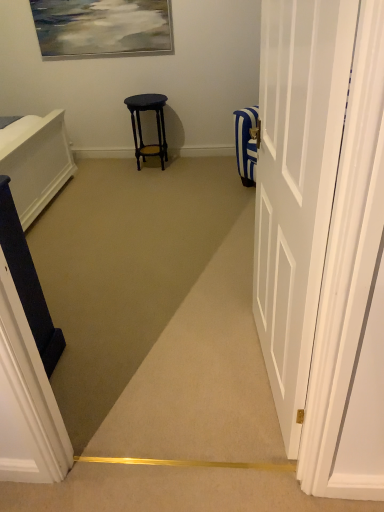
Identify the location of matte black stool at center. This screenshot has height=512, width=384. (141, 129).

Describe the element at coordinates (296, 184) in the screenshot. The width and height of the screenshot is (384, 512). I see `white glossy door at right` at that location.

Find the location of a particular element. matte black stool at center is located at coordinates (141, 129).

There is a dark blue fabric at left. Where is `door above it (from a real-world perspective)`? The height and width of the screenshot is (512, 384). door above it (from a real-world perspective) is located at coordinates (296, 184).

From the picture: Could you tell me if dark blue fabric at left is turned towards white glossy door at right?

No, dark blue fabric at left is not turned towards white glossy door at right.

From the picture: Is white glossy door at right completely or partially inside dark blue fabric at left?

No, white glossy door at right is not a part of dark blue fabric at left.

Can you tell me how much matte black stool at center and white glossy door at right differ in facing direction?

matte black stool at center and white glossy door at right are facing 85.1 degrees away from each other.

At what (x,y) coordinates should I click in order to perform the action: click on stool below the white glossy door at right (from a real-world perspective). Please return your answer as a coordinate pair (x, y). Looking at the image, I should click on (141, 129).

Is matte black stool at center situated inside white glossy door at right or outside?

matte black stool at center cannot be found inside white glossy door at right.

Is point (263, 115) farther from camera compared to point (153, 147)?

No, (263, 115) is closer to viewer.

Locate an element on the screen. The image size is (384, 512). stool that is under the white glossy door at right (from a real-world perspective) is located at coordinates (141, 129).

In the scene shown: In terms of width, does white glossy door at right look wider or thinner when compared to matte black stool at center?

Considering their sizes, white glossy door at right looks slimmer than matte black stool at center.

Is matte black stool at center far away from dark blue fabric at left?

Yes.

Between matte black stool at center and dark blue fabric at left, which one is positioned in front?

dark blue fabric at left.

Is matte black stool at center at the left side of dark blue fabric at left?

No, matte black stool at center is not to the left of dark blue fabric at left.

Is matte black stool at center oriented towards dark blue fabric at left?

Yes, matte black stool at center is turned towards dark blue fabric at left.

From the image's perspective, would you say white glossy door at right is shown under dark blue fabric at left?

Incorrect, from the image's perspective, white glossy door at right is higher than dark blue fabric at left.

Can you confirm if white glossy door at right is smaller than dark blue fabric at left?

No.

This screenshot has width=384, height=512. What are the coordinates of `door located on the right of dark blue fabric at left` in the screenshot? It's located at (296, 184).

In the scene shown: How many degrees apart are the facing directions of white glossy door at right and dark blue fabric at left?

They differ by 96.5 degrees in their facing directions.

In the scene shown: Is dark blue fabric at left located outside matte black stool at center?

Yes, dark blue fabric at left is located beyond the bounds of matte black stool at center.

Where is `furniture on the left of matte black stool at center`? furniture on the left of matte black stool at center is located at coordinates (28, 281).

Is dark blue fabric at left positioned before matte black stool at center?

That is True.

Would you consider dark blue fabric at left to be distant from matte black stool at center?

Yes, dark blue fabric at left is far from matte black stool at center.

I want to click on door lying above the dark blue fabric at left (from the image's perspective), so click(x=296, y=184).

Identify the location of door above the matte black stool at center (from a real-world perspective). (296, 184).

Looking at the image, which one is located further to dark blue fabric at left, matte black stool at center or white glossy door at right?

The object further to dark blue fabric at left is matte black stool at center.

Estimate the real-world distances between objects in this image. Which object is further from matte black stool at center, dark blue fabric at left or white glossy door at right?

Based on the image, white glossy door at right appears to be further to matte black stool at center.

Estimate the real-world distances between objects in this image. Which object is further from dark blue fabric at left, white glossy door at right or matte black stool at center?

matte black stool at center is positioned further to the anchor dark blue fabric at left.

Estimate the real-world distances between objects in this image. Which object is closer to white glossy door at right, matte black stool at center or dark blue fabric at left?

Based on the image, dark blue fabric at left appears to be nearer to white glossy door at right.

When comparing their distances from white glossy door at right, does dark blue fabric at left or matte black stool at center seem closer?

dark blue fabric at left lies closer to white glossy door at right than the other object.

Based on their spatial positions, is white glossy door at right or dark blue fabric at left further from matte black stool at center?

Among the two, white glossy door at right is located further to matte black stool at center.

You are a GUI agent. You are given a task and a screenshot of the screen. Output one action in this format:
    pyautogui.click(x=<x>, y=<y>)
    Task: Click on the furniture between white glossy door at right and matte black stool at center from front to back
    The height and width of the screenshot is (512, 384).
    Given the screenshot: What is the action you would take?
    pyautogui.click(x=28, y=281)